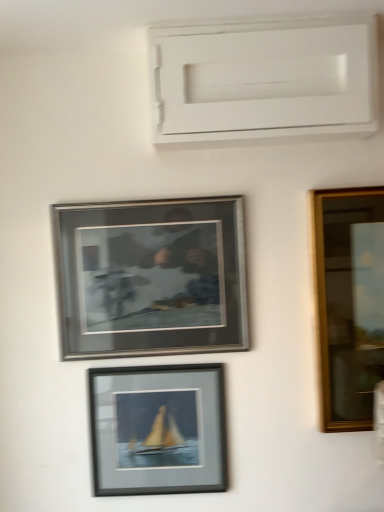
Question: Is white matte window frame at upper center taller or shorter than silver metallic frame at center, which is the first picture frame from top to bottom?

Choices:
 (A) tall
 (B) short

Answer: (B)

Question: Is white matte window frame at upper center spatially inside silver metallic frame at center, the 2th picture frame when ordered from bottom to top, or outside of it?

Choices:
 (A) inside
 (B) outside

Answer: (B)

Question: Which is farther from the matte black frame at center, the first picture frame when ordered from bottom to top?

Choices:
 (A) silver metallic frame at center, which is the first picture frame from top to bottom
 (B) white matte window frame at upper center

Answer: (B)

Question: Estimate the real-world distances between objects in this image. Which object is farther from the white matte window frame at upper center?

Choices:
 (A) silver metallic frame at center, which is the first picture frame from top to bottom
 (B) matte black frame at center, marked as the second picture frame in a top-to-bottom arrangement

Answer: (B)